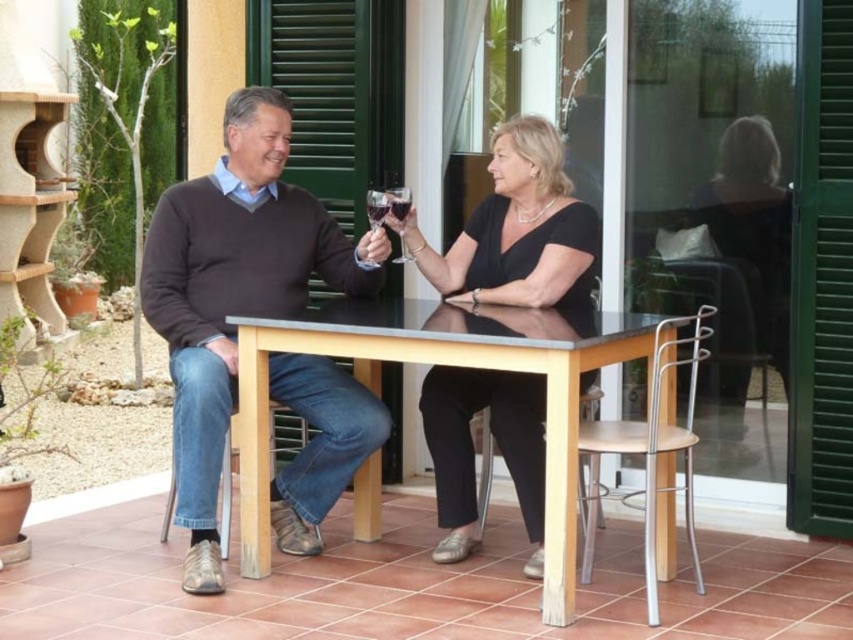
Which is above, light wood table at center or clear glass wine glass at center?

clear glass wine glass at center

Can you confirm if light wood table at center is bigger than clear glass wine glass at center?

Yes, light wood table at center is bigger than clear glass wine glass at center.

Between point (456, 307) and point (405, 253), which one is positioned in front?

Point (456, 307) is in front.

Locate an element on the screen. This screenshot has width=853, height=640. light wood table at center is located at coordinates (482, 369).

From the picture: Can you confirm if blonde hair at upper right is bigger than translucent glass wine at center?

Yes, blonde hair at upper right is bigger than translucent glass wine at center.

Is blonde hair at upper right shorter than translucent glass wine at center?

No.

Is point (775, 212) positioned behind point (399, 216)?

That is True.

Identify the location of blonde hair at upper right. (753, 225).

Does transparent glass at upper center have a larger size compared to translucent glass at center?

Yes, transparent glass at upper center is bigger than translucent glass at center.

Does transparent glass at upper center lie in front of translucent glass at center?

Yes, transparent glass at upper center is in front of translucent glass at center.

Is point (381, 198) more distant than point (386, 205)?

Yes, point (381, 198) is farther from viewer.

At what (x,y) coordinates should I click in order to perform the action: click on transparent glass at upper center. Please return your answer as a coordinate pair (x, y). This screenshot has height=640, width=853. Looking at the image, I should click on (376, 208).